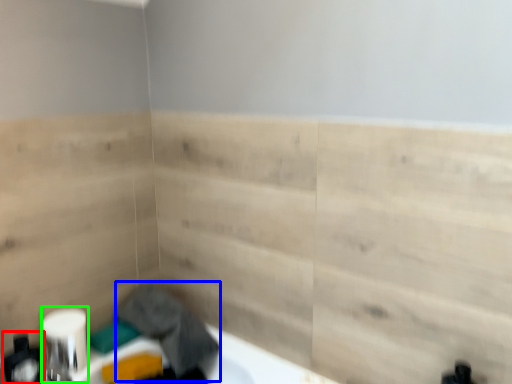
Question: Estimate the real-world distances between objects in this image. Which object is closer to toiletry (highlighted by a red box), laundry (highlighted by a blue box) or toilet paper (highlighted by a green box)?

Choices:
 (A) laundry
 (B) toilet paper

Answer: (B)